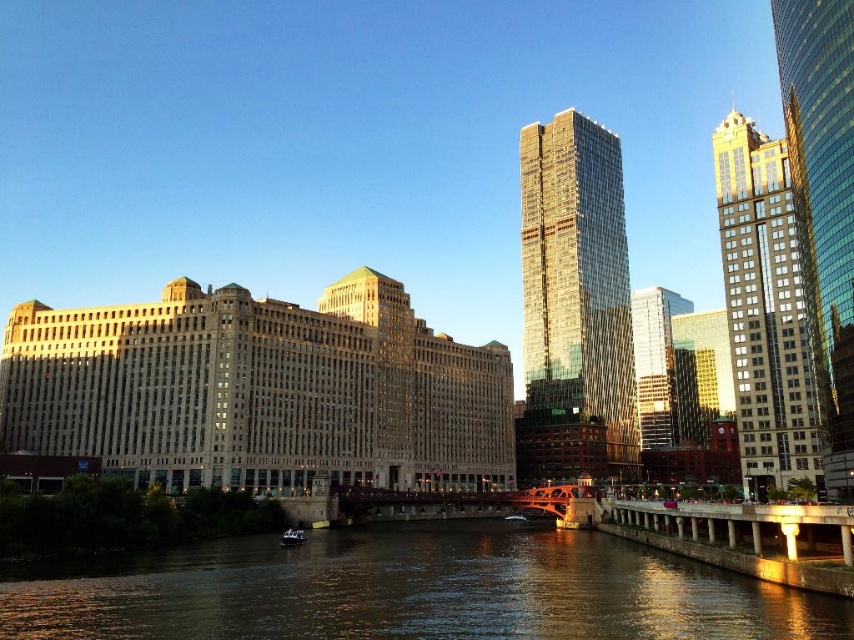
Question: Can you confirm if gold reflective glass skyscraper at upper right is bigger than metallic silver boat at center?

Choices:
 (A) yes
 (B) no

Answer: (A)

Question: Is shiny glass skyscraper at center closer to the viewer compared to metallic silver boat at center?

Choices:
 (A) yes
 (B) no

Answer: (B)

Question: Does dark water at center appear on the left side of metallic silver boat at center?

Choices:
 (A) no
 (B) yes

Answer: (A)

Question: Which object is positioned farthest from the white plastic boat at center?

Choices:
 (A) metallic silver boat at center
 (B) shiny glass skyscraper at center

Answer: (B)

Question: Which point is closer to the camera?

Choices:
 (A) white plastic boat at center
 (B) metallic silver boat at center
 (C) gold reflective glass skyscraper at upper right
 (D) shiny glass skyscraper at center

Answer: (B)

Question: Which of the following is the closest to the observer?

Choices:
 (A) white plastic boat at center
 (B) shiny glass skyscraper at center
 (C) dark water at center

Answer: (C)